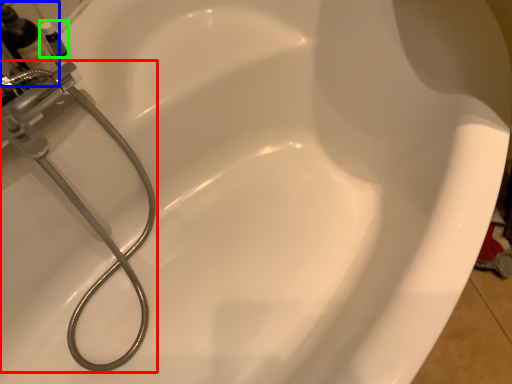
Question: Which object is the closest to the plumbing fixture (highlighted by a red box)? Choose among these: bottle (highlighted by a blue box) or toiletry (highlighted by a green box).

Choices:
 (A) bottle
 (B) toiletry

Answer: (A)